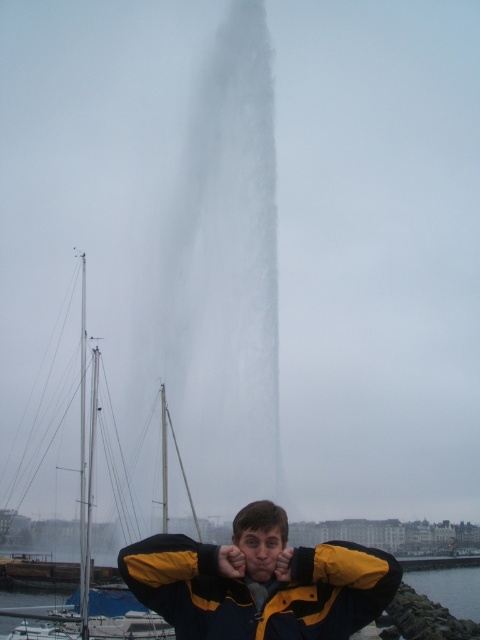
Is white matte sailboat at left to the right of white frothy water at center from the viewer's perspective?

In fact, white matte sailboat at left is to the left of white frothy water at center.

Is white matte sailboat at left above white frothy water at center?

Indeed, white matte sailboat at left is positioned over white frothy water at center.

Find the location of a particular element. The width and height of the screenshot is (480, 640). white matte sailboat at left is located at coordinates (84, 499).

Between yellow/black jacket at center and yellow matte hand at center, which one is positioned lower?

yellow/black jacket at center is lower down.

Does point (203, 579) come behind point (276, 563)?

No, it is in front of (276, 563).

Between point (265, 564) and point (276, 568), which one is positioned in front?

Point (276, 568) is more forward.

Find the location of a particular element. The width and height of the screenshot is (480, 640). yellow/black jacket at center is located at coordinates (260, 582).

Can you confirm if matte black hand at center is shorter than yellow matte hand at center?

Correct, matte black hand at center is not as tall as yellow matte hand at center.

Is matte black hand at center smaller than yellow matte hand at center?

Actually, matte black hand at center might be larger than yellow matte hand at center.

Locate an element on the screen. Image resolution: width=480 pixels, height=640 pixels. matte black hand at center is located at coordinates (230, 561).